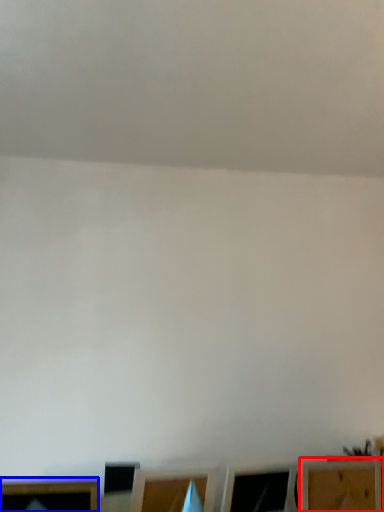
Question: Which point is further to the camera, furniture (highlighted by a red box) or furniture (highlighted by a blue box)?

Choices:
 (A) furniture
 (B) furniture

Answer: (A)